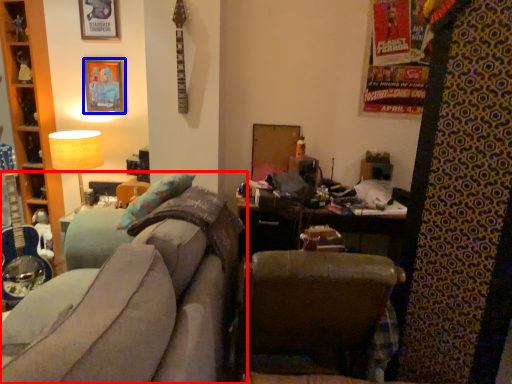
Question: Which point is further to the camera, studio couch (highlighted by a red box) or picture frame (highlighted by a blue box)?

Choices:
 (A) studio couch
 (B) picture frame

Answer: (B)